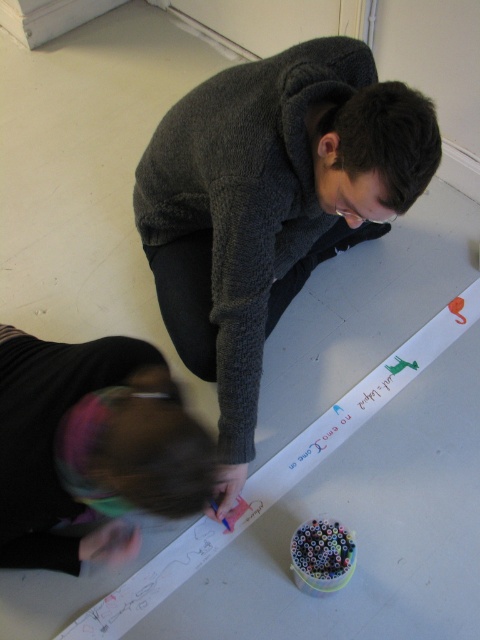
You are standing in a room where two people are working on a long white paper. You see a dark gray sweater at upper center and a black hair at lower left. Which object is positioned more to the right?

The dark gray sweater at upper center is positioned to the right of the black hair at lower left.

You are standing in front of the two people working on the long white paper. Which person is closer to you, the one wearing the dark gray sweater at upper center or the one with black hair at lower left?

The dark gray sweater at upper center is closer to you because it is further to the viewer than the black hair at lower left.